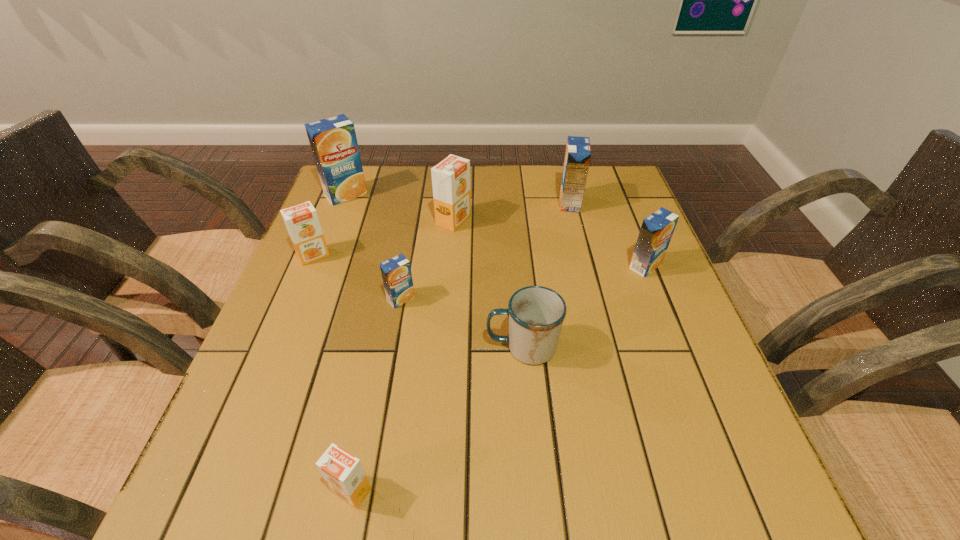
Find the location of a particular element. This screenshot has height=540, width=960. vacant space situated on the front of the rightmost orange juice is located at coordinates (705, 415).

Identify the location of free space located on the handle side of the seventh farthest object. The height and width of the screenshot is (540, 960). (426, 347).

This screenshot has width=960, height=540. I want to click on free spot located 0.240m on the handle side of the seventh farthest object, so click(x=367, y=347).

Where is `free space located on the handle side of the seventh farthest object`? free space located on the handle side of the seventh farthest object is located at coordinates (352, 347).

This screenshot has height=540, width=960. I want to click on free spot located 0.290m on the back of the third blue orange_juice from right to left, so click(416, 214).

Find the location of a particular element. free space located 0.140m on the right of the nearest orange orange juice is located at coordinates (461, 490).

The image size is (960, 540). Identify the location of object positioned at the near edge. (344, 474).

You are a GUI agent. You are given a task and a screenshot of the screen. Output one action in this format:
    pyautogui.click(x=<x>, y=<y>)
    Task: Click on the object present at the far left corner
    The image size is (960, 540).
    Given the screenshot: What is the action you would take?
    pyautogui.click(x=333, y=141)

Where is `object at the far right corner`? object at the far right corner is located at coordinates (578, 151).

This screenshot has height=540, width=960. Find the location of `vacant space at the far edge`. vacant space at the far edge is located at coordinates (413, 197).